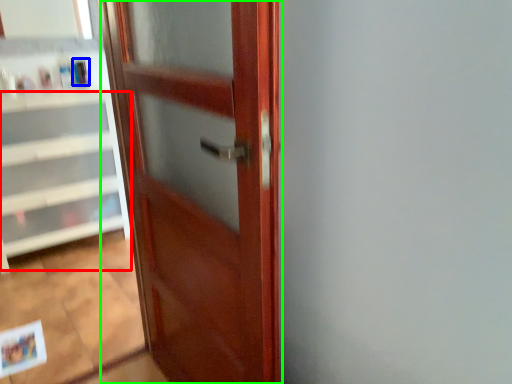
Question: Which is nearer to the cabinetry (highlighted by a red box)? toiletry (highlighted by a blue box) or door (highlighted by a green box).

Choices:
 (A) toiletry
 (B) door

Answer: (A)